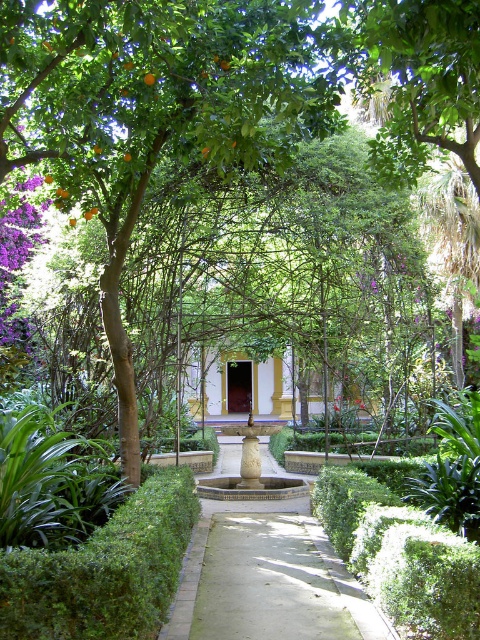
From the picture: Is smooth concrete path at center positioned at the back of green leafy hedge at lower left?

Yes.

Is smooth concrete path at center in front of green leafy hedge at lower left?

No, it is not.

Does point (287, 544) come farther from viewer compared to point (9, 612)?

Yes, it is behind point (9, 612).

Locate an element on the screen. This screenshot has height=640, width=480. smooth concrete path at center is located at coordinates (267, 579).